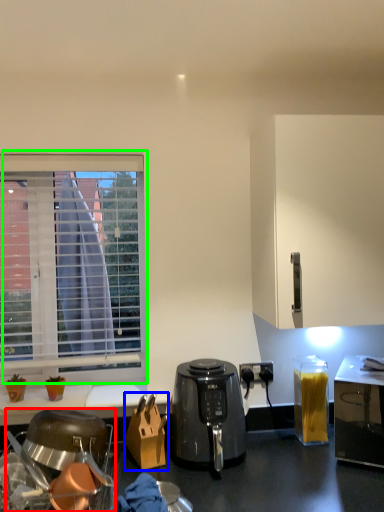
Question: Which is nearer to the kitchen appliance (highlighted by a red box)? cardboard box (highlighted by a blue box) or window (highlighted by a green box).

Choices:
 (A) cardboard box
 (B) window

Answer: (A)